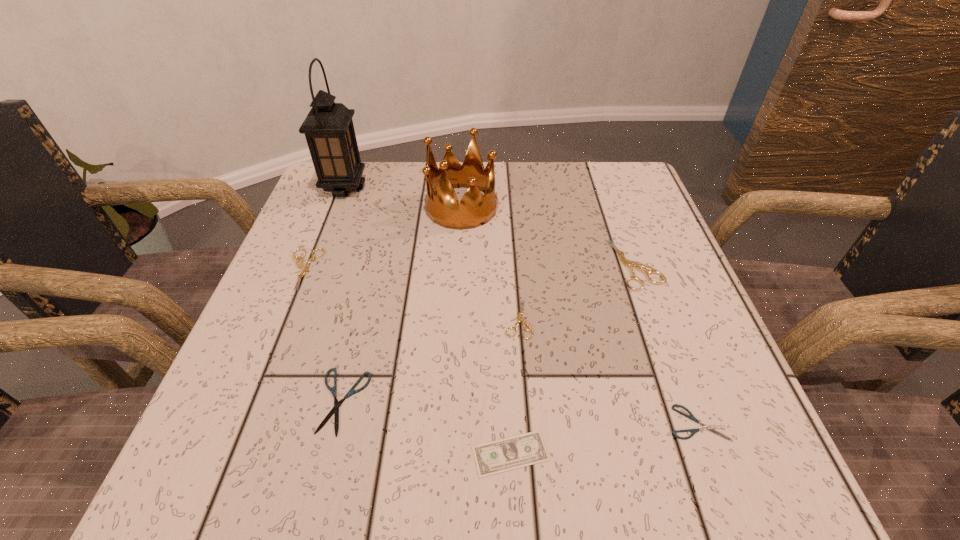
I want to click on the fourth shears from right to left, so click(335, 410).

I want to click on the right black shears, so click(704, 427).

You are a GUI agent. You are given a task and a screenshot of the screen. Output one action in this format:
    pyautogui.click(x=<x>, y=<y>)
    Task: Click on the seventh tallest object
    The image size is (960, 540).
    Given the screenshot: What is the action you would take?
    pyautogui.click(x=704, y=427)

Where is `the shortest object`? the shortest object is located at coordinates (523, 450).

Identify the location of green money. The height and width of the screenshot is (540, 960). click(x=523, y=450).

I want to click on vacant space situated 0.220m on the right of the tallest object, so (456, 188).

Locate an element on the screen. free spot located 0.090m on the back of the crown is located at coordinates (464, 167).

Where is `free space located on the front of the sixth shortest object`? This screenshot has width=960, height=540. free space located on the front of the sixth shortest object is located at coordinates (684, 402).

Locate an element on the screen. Image resolution: width=960 pixels, height=540 pixels. vacant space located on the right of the leftmost shears is located at coordinates (450, 269).

The width and height of the screenshot is (960, 540). What are the coordinates of `vacant space located 0.180m on the left of the smallest beige shears` in the screenshot? It's located at (403, 319).